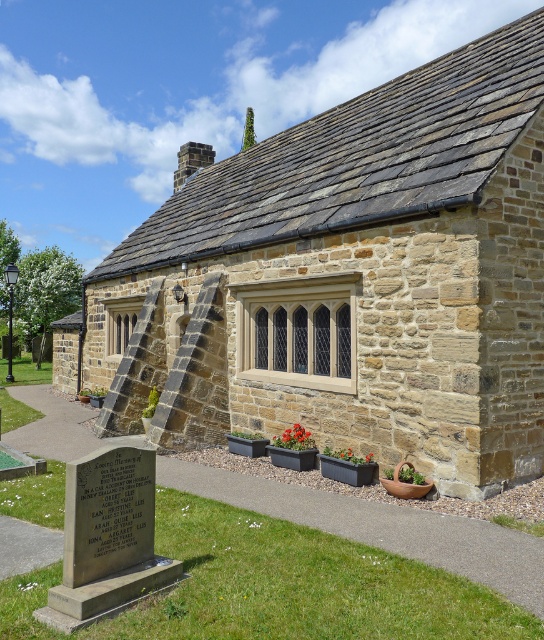
Can you confirm if stone textured cottage at center is shorter than gray stone gravestone at lower left?

No, stone textured cottage at center is not shorter than gray stone gravestone at lower left.

Who is shorter, stone textured cottage at center or gray stone gravestone at lower left?

gray stone gravestone at lower left is shorter.

Between point (441, 268) and point (151, 506), which one is positioned in front?

Positioned in front is point (151, 506).

This screenshot has height=640, width=544. Identify the location of stone textured cottage at center. (350, 278).